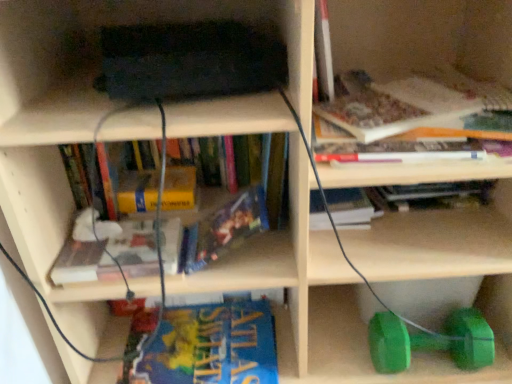
Find the location of a particular element. blue glossy book at lower center, positioned as the 1th book in bottom-to-top order is located at coordinates (211, 346).

The height and width of the screenshot is (384, 512). Describe the element at coordinates (431, 341) in the screenshot. I see `green rubber dumbbell at lower right` at that location.

Identify the location of hardcover book at center, the fourth book in the bottom-to-top sequence. This screenshot has height=384, width=512. (224, 229).

Identify the location of hardcover book at center, placed as the 3th book when sorted from bottom to top. The width and height of the screenshot is (512, 384). (135, 248).

From a real-world perspective, which object stands above the other?

yellow paperback book at center, which ranks as the fourth book in top-to-bottom order.

Is green rubber dumbbell at lower right aimed at yellow paperback book at center, which ranks as the fourth book in top-to-bottom order?

No, green rubber dumbbell at lower right is not oriented towards yellow paperback book at center, which ranks as the fourth book in top-to-bottom order.

Find the location of a particular element. The image size is (512, 384). the 6th book to the left of the green rubber dumbbell at lower right, counting from the anchor's position is located at coordinates (138, 191).

Can you confirm if green rubber dumbbell at lower right is positioned to the right of yellow paperback book at center, which appears as the 5th book when ordered from the bottom?

Yes.

Consider the image. In the image, is hardcover book at upper right, which is the seventh book in bottom-to-top order, positioned in front of or behind blue glossy book at lower center, positioned as the 1th book in bottom-to-top order?

Clearly, hardcover book at upper right, which is the seventh book in bottom-to-top order, is in front of blue glossy book at lower center, positioned as the 1th book in bottom-to-top order.

From the image's perspective, between hardcover book at upper right, the 2th book when ordered from top to bottom, and blue glossy book at lower center, positioned as the 1th book in bottom-to-top order, who is located below?

From the image's view, blue glossy book at lower center, positioned as the 1th book in bottom-to-top order, is below.

Considering the sizes of objects hardcover book at upper right, which is the seventh book in bottom-to-top order, and blue glossy book at lower center, the 8th book in the top-to-bottom sequence, in the image provided, who is thinner, hardcover book at upper right, which is the seventh book in bottom-to-top order, or blue glossy book at lower center, the 8th book in the top-to-bottom sequence,?

With smaller width is blue glossy book at lower center, the 8th book in the top-to-bottom sequence.

Which of these two, blue matte book at center, positioned as the 7th book in top-to-bottom order, or hardcover book at upper right, acting as the first book starting from the top, is bigger?

With larger size is hardcover book at upper right, acting as the first book starting from the top.

Is blue matte book at center, positioned as the 7th book in top-to-bottom order, thinner than hardcover book at upper right, which is the eighth book from bottom to top?

Correct, the width of blue matte book at center, positioned as the 7th book in top-to-bottom order, is less than that of hardcover book at upper right, which is the eighth book from bottom to top.

Is blue matte book at center, positioned as the 7th book in top-to-bottom order, shorter than hardcover book at upper right, acting as the first book starting from the top?

Indeed, blue matte book at center, positioned as the 7th book in top-to-bottom order, has a lesser height compared to hardcover book at upper right, acting as the first book starting from the top.

Is blue matte book at center, which is the 2th book from bottom to top, not close to hardcover book at upper right, acting as the first book starting from the top?

No, blue matte book at center, which is the 2th book from bottom to top, is not far away from hardcover book at upper right, acting as the first book starting from the top.

Considering the positions of objects hardcover book at upper right, which is the seventh book in bottom-to-top order, and blue matte book at center, which is the 2th book from bottom to top, in the image provided, who is more to the right, hardcover book at upper right, which is the seventh book in bottom-to-top order, or blue matte book at center, which is the 2th book from bottom to top,?

From the viewer's perspective, hardcover book at upper right, which is the seventh book in bottom-to-top order, appears more on the right side.

Which is correct: hardcover book at upper right, which is the seventh book in bottom-to-top order, is inside blue matte book at center, which is the 2th book from bottom to top, or outside of it?

hardcover book at upper right, which is the seventh book in bottom-to-top order, is located beyond the bounds of blue matte book at center, which is the 2th book from bottom to top.

From the image's perspective, does hardcover book at upper right, the 2th book when ordered from top to bottom, appear lower than blue matte book at center, which is the 2th book from bottom to top?

No, from the image's perspective, hardcover book at upper right, the 2th book when ordered from top to bottom, is not beneath blue matte book at center, which is the 2th book from bottom to top.

Can you confirm if hardcover book at upper right, which is the seventh book in bottom-to-top order, is shorter than blue matte book at center, which is the 2th book from bottom to top?

No.

From the picture: What's the angular difference between hardcover book at upper center, the third book when ordered from top to bottom, and hardcover book at center, placed as the 3th book when sorted from bottom to top,'s facing directions?

There is a 2.11-degree angle between the facing directions of hardcover book at upper center, the third book when ordered from top to bottom, and hardcover book at center, placed as the 3th book when sorted from bottom to top.

Considering the points (391, 188) and (134, 224), which point is in front, point (391, 188) or point (134, 224)?

Point (134, 224)

Is hardcover book at upper center, the third book when ordered from top to bottom, directly adjacent to hardcover book at center, the 6th book positioned from the top?

No, hardcover book at upper center, the third book when ordered from top to bottom, is not beside hardcover book at center, the 6th book positioned from the top.

Does hardcover book at upper center, the third book when ordered from top to bottom, have a smaller size compared to hardcover book at center, placed as the 3th book when sorted from bottom to top?

Incorrect, hardcover book at upper center, the third book when ordered from top to bottom, is not smaller in size than hardcover book at center, placed as the 3th book when sorted from bottom to top.

Identify the location of toy behind the hardcover book at upper right, the 2th book when ordered from top to bottom. (431, 341).

From the image's perspective, would you say green rubber dumbbell at lower right is shown under hardcover book at upper right, which is the seventh book in bottom-to-top order?

Indeed, from the image's perspective, green rubber dumbbell at lower right is shown beneath hardcover book at upper right, which is the seventh book in bottom-to-top order.

Is green rubber dumbbell at lower right in front of hardcover book at upper right, which is the seventh book in bottom-to-top order?

No, green rubber dumbbell at lower right is behind hardcover book at upper right, which is the seventh book in bottom-to-top order.

Can you confirm if green rubber dumbbell at lower right is wider than hardcover book at upper right, the 2th book when ordered from top to bottom?

No, green rubber dumbbell at lower right is not wider than hardcover book at upper right, the 2th book when ordered from top to bottom.

Does yellow paperback book at center, which ranks as the fourth book in top-to-bottom order, contain blue glossy book at lower center, positioned as the 1th book in bottom-to-top order?

No, blue glossy book at lower center, positioned as the 1th book in bottom-to-top order, is not surrounded by yellow paperback book at center, which ranks as the fourth book in top-to-bottom order.

Which of these two, yellow paperback book at center, which appears as the 5th book when ordered from the bottom, or blue glossy book at lower center, the 8th book in the top-to-bottom sequence, is wider?

blue glossy book at lower center, the 8th book in the top-to-bottom sequence.

Is point (185, 185) closer to camera compared to point (219, 368)?

No, it is behind (219, 368).

The image size is (512, 384). Identify the location of toy in front of the yellow paperback book at center, which ranks as the fourth book in top-to-bottom order. 431,341.

The width and height of the screenshot is (512, 384). I want to click on book that is the 6th one above the blue glossy book at lower center, positioned as the 1th book in bottom-to-top order (from a real-world perspective), so click(x=416, y=104).

Which object lies further to the anchor point hardcover book at upper center, the third book when ordered from top to bottom, green rubber dumbbell at lower right or hardcover book at upper right, which is the eighth book from bottom to top?

Among the two, hardcover book at upper right, which is the eighth book from bottom to top, is located further to hardcover book at upper center, the third book when ordered from top to bottom.

Looking at the image, which one is located further to green rubber dumbbell at lower right, blue matte book at center, positioned as the 7th book in top-to-bottom order, or hardcover book at center, the fifth book from the top?

hardcover book at center, the fifth book from the top, lies further to green rubber dumbbell at lower right than the other object.

Which object lies nearer to the anchor point yellow paperback book at center, which appears as the 5th book when ordered from the bottom, blue glossy book at lower center, the 8th book in the top-to-bottom sequence, or hardcover book at upper right, acting as the first book starting from the top?

Among the two, blue glossy book at lower center, the 8th book in the top-to-bottom sequence, is located nearer to yellow paperback book at center, which appears as the 5th book when ordered from the bottom.

Considering their positions, is hardcover book at upper center, the third book when ordered from top to bottom, positioned further to hardcover book at upper right, which is the eighth book from bottom to top, than blue matte book at center, which is the 2th book from bottom to top?

Among the two, blue matte book at center, which is the 2th book from bottom to top, is located further to hardcover book at upper right, which is the eighth book from bottom to top.

Estimate the real-world distances between objects in this image. Which object is further from yellow paperback book at center, which ranks as the fourth book in top-to-bottom order, blue glossy book at lower center, the 8th book in the top-to-bottom sequence, or hardcover book at upper center, the third book when ordered from top to bottom?

Based on the image, hardcover book at upper center, the third book when ordered from top to bottom, appears to be further to yellow paperback book at center, which ranks as the fourth book in top-to-bottom order.

Estimate the real-world distances between objects in this image. Which object is closer to yellow paperback book at center, which ranks as the fourth book in top-to-bottom order, blue matte book at center, positioned as the 7th book in top-to-bottom order, or hardcover book at upper right, the 2th book when ordered from top to bottom?

blue matte book at center, positioned as the 7th book in top-to-bottom order, is closer to yellow paperback book at center, which ranks as the fourth book in top-to-bottom order.

Looking at this image, considering their positions, is hardcover book at upper right, which is the seventh book in bottom-to-top order, positioned closer to blue glossy book at lower center, the 8th book in the top-to-bottom sequence, than yellow paperback book at center, which ranks as the fourth book in top-to-bottom order?

Among the two, yellow paperback book at center, which ranks as the fourth book in top-to-bottom order, is located nearer to blue glossy book at lower center, the 8th book in the top-to-bottom sequence.

Looking at this image, estimate the real-world distances between objects in this image. Which object is further from hardcover book at center, placed as the 3th book when sorted from bottom to top, hardcover book at upper right, acting as the first book starting from the top, or yellow paperback book at center, which appears as the 5th book when ordered from the bottom?

The object further to hardcover book at center, placed as the 3th book when sorted from bottom to top, is hardcover book at upper right, acting as the first book starting from the top.

Where is `toy between yellow paperback book at center, which appears as the 5th book when ordered from the bottom, and hardcover book at upper center, the sixth book positioned from the bottom`? toy between yellow paperback book at center, which appears as the 5th book when ordered from the bottom, and hardcover book at upper center, the sixth book positioned from the bottom is located at coordinates [x=431, y=341].

Find the location of `toy between blue glossy book at lower center, positioned as the 1th book in bottom-to-top order, and hardcover book at upper center, the sixth book positioned from the bottom`. toy between blue glossy book at lower center, positioned as the 1th book in bottom-to-top order, and hardcover book at upper center, the sixth book positioned from the bottom is located at coordinates (431, 341).

The width and height of the screenshot is (512, 384). I want to click on toy between hardcover book at upper right, the 2th book when ordered from top to bottom, and blue glossy book at lower center, positioned as the 1th book in bottom-to-top order, in the up-down direction, so click(431, 341).

Find the location of a particular element. toy between hardcover book at center, the fifth book from the top, and hardcover book at upper center, the sixth book positioned from the bottom, in the horizontal direction is located at coordinates (431, 341).